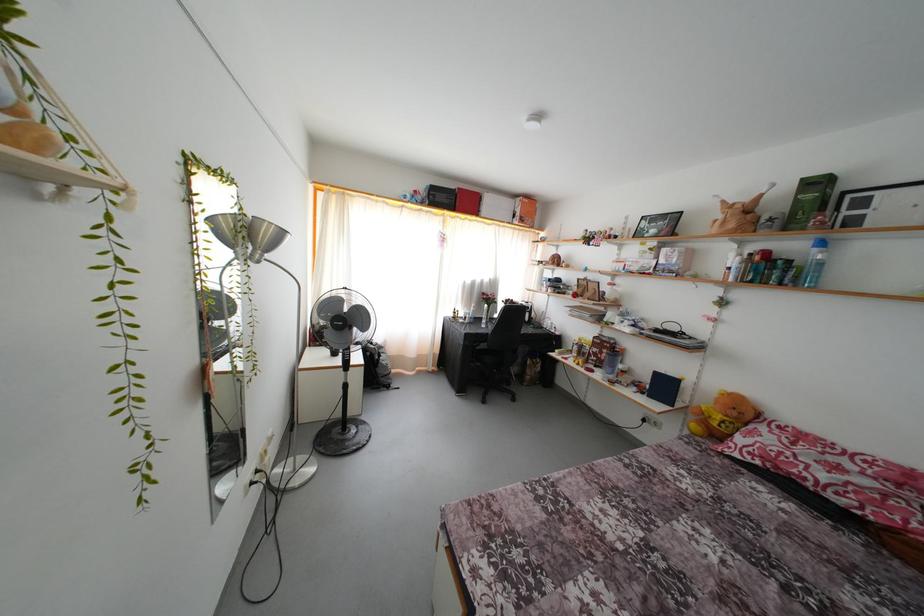
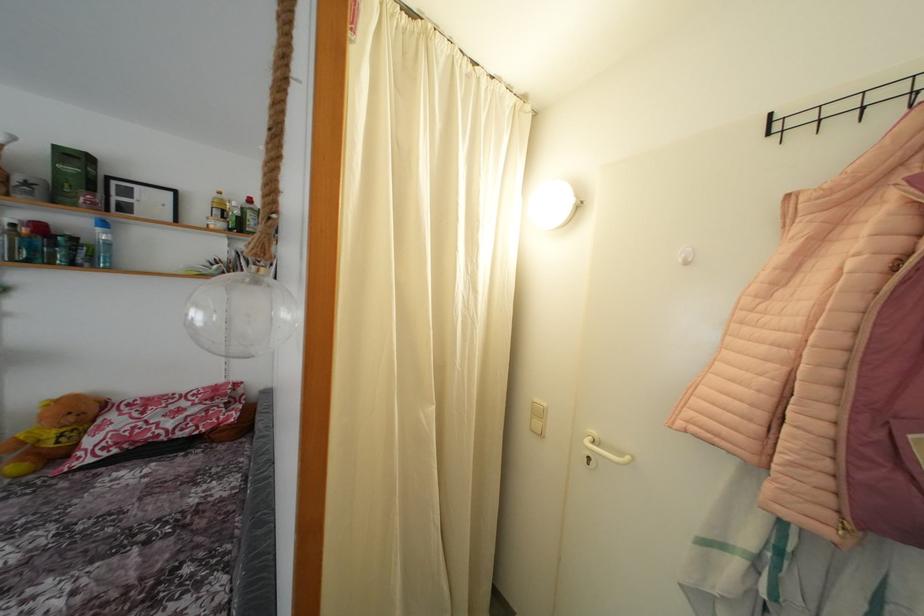
The point at (821,256) is marked in the first image. Where is the corresponding point in the second image?

(104, 236)